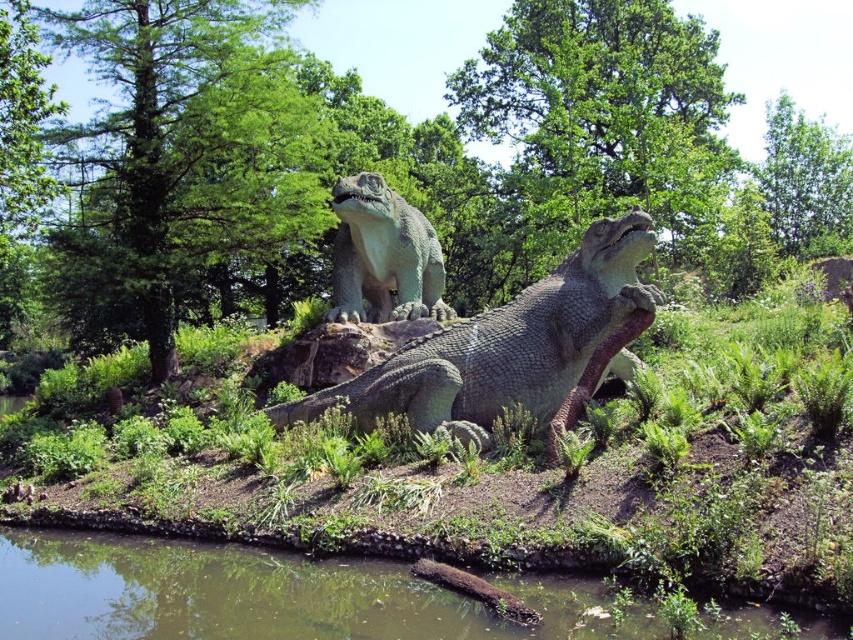
You are a visitor standing in front of the greenish water at lower center and the green textured statue at center. Which object is nearer to you?

The greenish water at lower center is closer to the viewer than the green textured statue at center.

You are a visitor at the park and want to take a photo of the green textured statue at center without the greenish water at lower center appearing too prominently in the background. Based on their heights, which object should you focus on to ensure the statue is the main subject?

The greenish water at lower center has a lesser height compared to the green textured statue at center. To make the statue the main subject, focus on the taller green textured statue at center since it stands higher than the water, allowing it to dominate the frame.

Looking at this image, you are a visitor at the dinosaur exhibit. You notice the greenish water at lower center and the smooth gray crocodile at center. Which object is positioned higher in the image?

The smooth gray crocodile at center is positioned higher than the greenish water at lower center because the greenish water at lower center is below smooth gray crocodile at center.